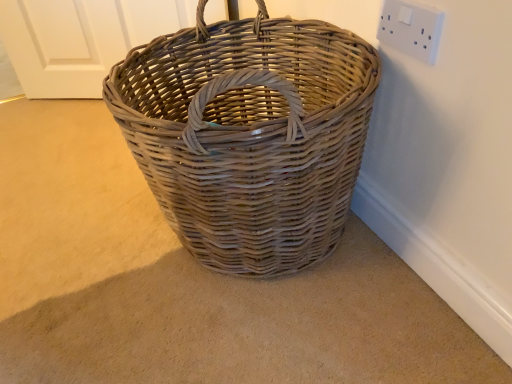
This screenshot has width=512, height=384. What do you see at coordinates (249, 135) in the screenshot? I see `natural wicker picnic basket at center` at bounding box center [249, 135].

In order to click on natural wicker picnic basket at center in this screenshot , I will do `click(249, 135)`.

I want to click on white plastic socket at upper right, so click(x=411, y=29).

The image size is (512, 384). What do you see at coordinates (411, 29) in the screenshot? I see `white plastic socket at upper right` at bounding box center [411, 29].

This screenshot has width=512, height=384. In order to click on natural wicker picnic basket at center in this screenshot , I will do `click(249, 135)`.

Can you confirm if white plastic socket at upper right is positioned to the right of natural wicker picnic basket at center?

Yes, white plastic socket at upper right is to the right of natural wicker picnic basket at center.

Is white plastic socket at upper right positioned in front of natural wicker picnic basket at center?

No, it is not.

Which is farther from the camera, (439, 37) or (293, 104)?

The point (439, 37) is behind.

From the image's perspective, is white plastic socket at upper right located above or below natural wicker picnic basket at center?

Clearly, from the image's perspective, white plastic socket at upper right is above natural wicker picnic basket at center.

From a real-world perspective, who is located lower, white plastic socket at upper right or natural wicker picnic basket at center?

From a 3D spatial view, natural wicker picnic basket at center is below.

Which of these two, white plastic socket at upper right or natural wicker picnic basket at center, is thinner?

white plastic socket at upper right is thinner.

Which of these two, white plastic socket at upper right or natural wicker picnic basket at center, stands shorter?

Standing shorter between the two is white plastic socket at upper right.

Is white plastic socket at upper right smaller than natural wicker picnic basket at center?

Indeed, white plastic socket at upper right has a smaller size compared to natural wicker picnic basket at center.

Is white plastic socket at upper right located outside natural wicker picnic basket at center?

Indeed, white plastic socket at upper right is completely outside natural wicker picnic basket at center.

Are white plastic socket at upper right and natural wicker picnic basket at center far apart?

white plastic socket at upper right is actually quite close to natural wicker picnic basket at center.

Could you tell me if white plastic socket at upper right is turned towards natural wicker picnic basket at center?

Yes, white plastic socket at upper right is aimed at natural wicker picnic basket at center.

How different are the orientations of white plastic socket at upper right and natural wicker picnic basket at center in degrees?

white plastic socket at upper right and natural wicker picnic basket at center are facing 0.19 degrees away from each other.

This screenshot has width=512, height=384. Identify the location of electric outlet above the natural wicker picnic basket at center (from the image's perspective). (411, 29).

Which object is positioned more to the left, natural wicker picnic basket at center or white plastic socket at upper right?

natural wicker picnic basket at center.

Which object is closer to the camera, natural wicker picnic basket at center or white plastic socket at upper right?

Positioned in front is natural wicker picnic basket at center.

Is point (373, 71) positioned after point (406, 17)?

That is True.

From the image's perspective, is natural wicker picnic basket at center over white plastic socket at upper right?

Incorrect, from the image's perspective, natural wicker picnic basket at center is lower than white plastic socket at upper right.

From a real-world perspective, is natural wicker picnic basket at center beneath white plastic socket at upper right?

Yes.

Considering the sizes of objects natural wicker picnic basket at center and white plastic socket at upper right in the image provided, who is wider, natural wicker picnic basket at center or white plastic socket at upper right?

natural wicker picnic basket at center is wider.

Can you confirm if natural wicker picnic basket at center is shorter than white plastic socket at upper right?

In fact, natural wicker picnic basket at center may be taller than white plastic socket at upper right.

Does natural wicker picnic basket at center have a smaller size compared to white plastic socket at upper right?

Actually, natural wicker picnic basket at center might be larger than white plastic socket at upper right.

Is natural wicker picnic basket at center positioned beyond the bounds of white plastic socket at upper right?

Absolutely, natural wicker picnic basket at center is external to white plastic socket at upper right.

Is natural wicker picnic basket at center with white plastic socket at upper right?

There is a gap between natural wicker picnic basket at center and white plastic socket at upper right.

Is white plastic socket at upper right at the back of natural wicker picnic basket at center?

Yes, white plastic socket at upper right is at the back of natural wicker picnic basket at center.

You are a GUI agent. You are given a task and a screenshot of the screen. Output one action in this format:
    pyautogui.click(x=<x>, y=<y>)
    Task: Click on the picnic basket below the white plastic socket at upper right (from a real-world perspective)
    This screenshot has height=384, width=512.
    Given the screenshot: What is the action you would take?
    pyautogui.click(x=249, y=135)

Image resolution: width=512 pixels, height=384 pixels. I want to click on picnic basket on the left of white plastic socket at upper right, so click(249, 135).

This screenshot has width=512, height=384. Identify the location of electric outlet behind the natural wicker picnic basket at center. (411, 29).